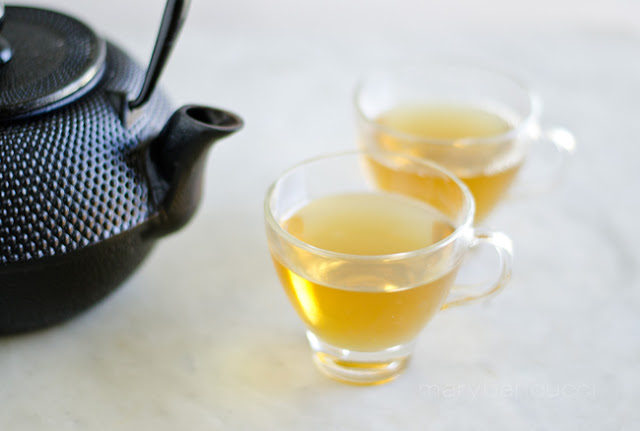
The image size is (640, 431). I want to click on white surface, so click(185, 399).